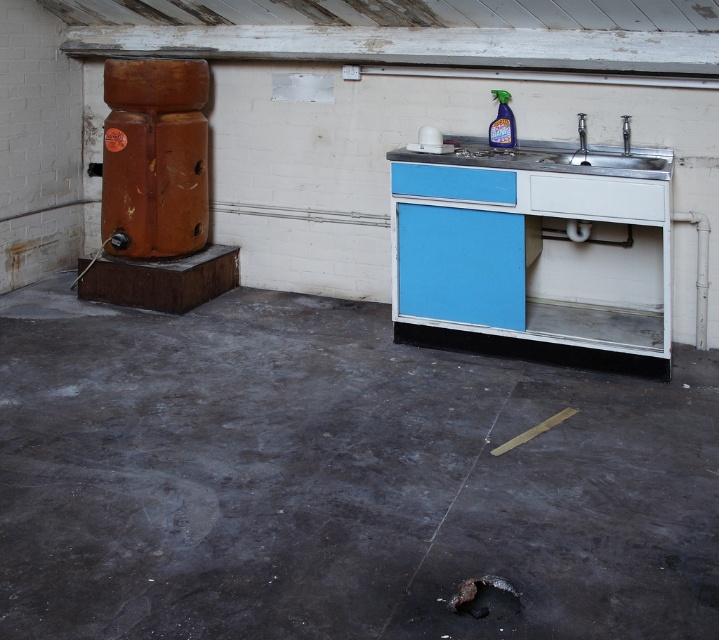
From the picture: Is stainless steel sink at upper right above silver metallic faucet at right?

No.

In the scene shown: Between stainless steel sink at upper right and silver metallic faucet at right, which one is positioned lower?

stainless steel sink at upper right is below.

I want to click on stainless steel sink at upper right, so click(x=600, y=156).

Is stainless steel sink at right taller than stainless steel sink at upper right?

Indeed, stainless steel sink at right has a greater height compared to stainless steel sink at upper right.

Is stainless steel sink at right smaller than stainless steel sink at upper right?

No, stainless steel sink at right is not smaller than stainless steel sink at upper right.

This screenshot has height=640, width=719. What do you see at coordinates (535, 252) in the screenshot? I see `stainless steel sink at right` at bounding box center [535, 252].

Find the location of a particular element. This screenshot has width=719, height=640. stainless steel sink at right is located at coordinates (535, 252).

Does stainless steel sink at right appear under translucent plastic spray bottle at upper center?

Yes, stainless steel sink at right is below translucent plastic spray bottle at upper center.

Can you confirm if stainless steel sink at right is positioned above translucent plastic spray bottle at upper center?

No, stainless steel sink at right is not above translucent plastic spray bottle at upper center.

Which is behind, point (597, 275) or point (510, 122)?

Positioned behind is point (597, 275).

Identify the location of stainless steel sink at right. (535, 252).